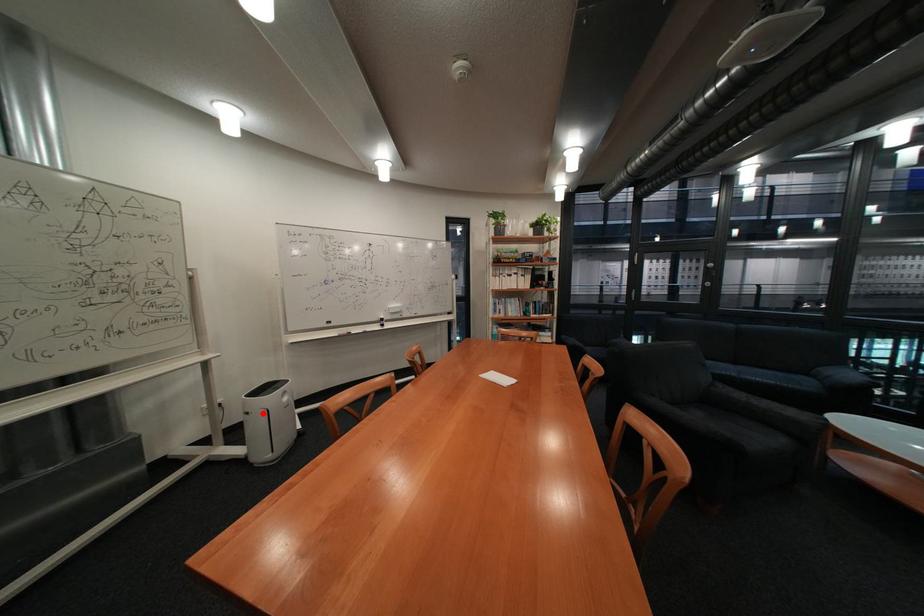
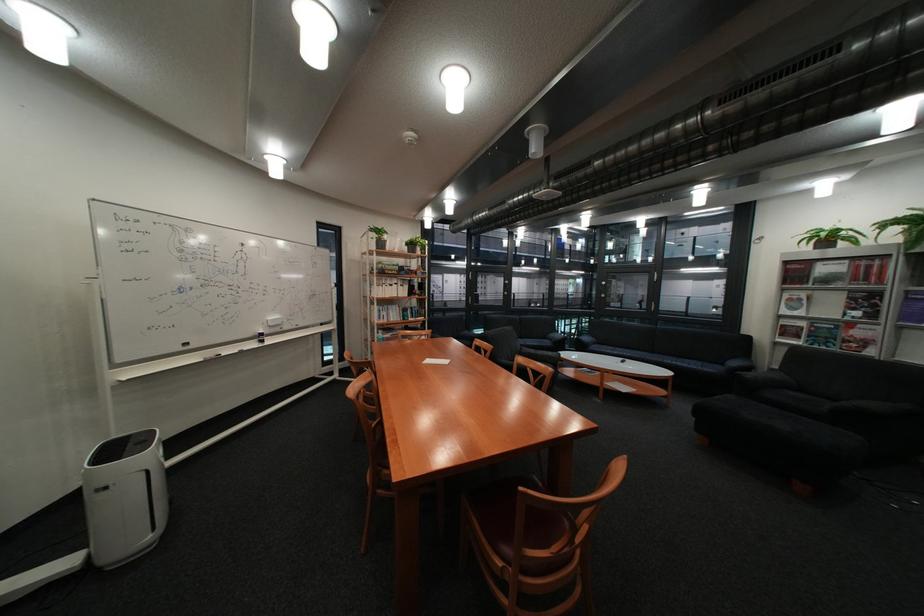
Question: I am providing you with two images of the same scene from different viewpoints. Given a red point in image1, look at the same physical point in image2. Is it:

Choices:
 (A) Closer to the viewpoint
 (B) Farther from the viewpoint

Answer: (A)